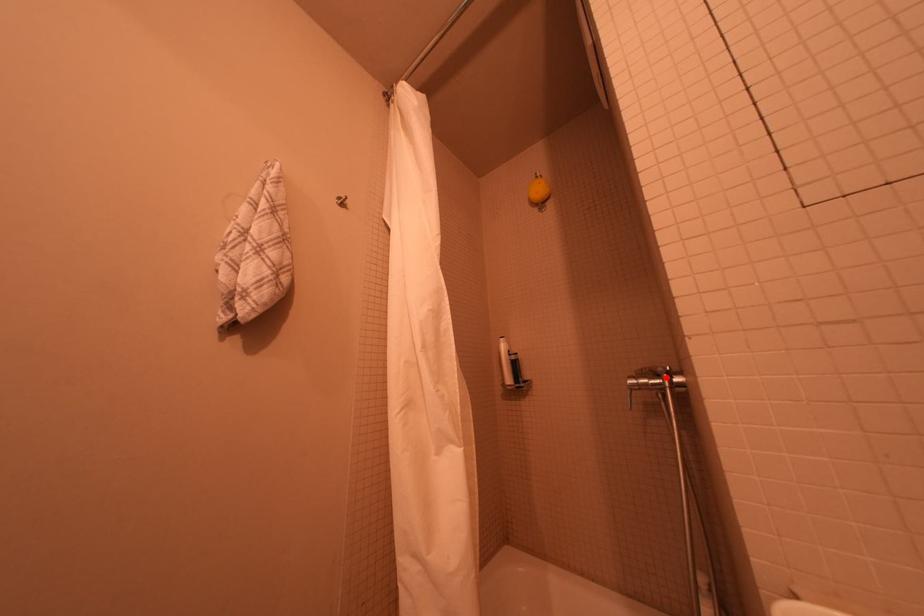
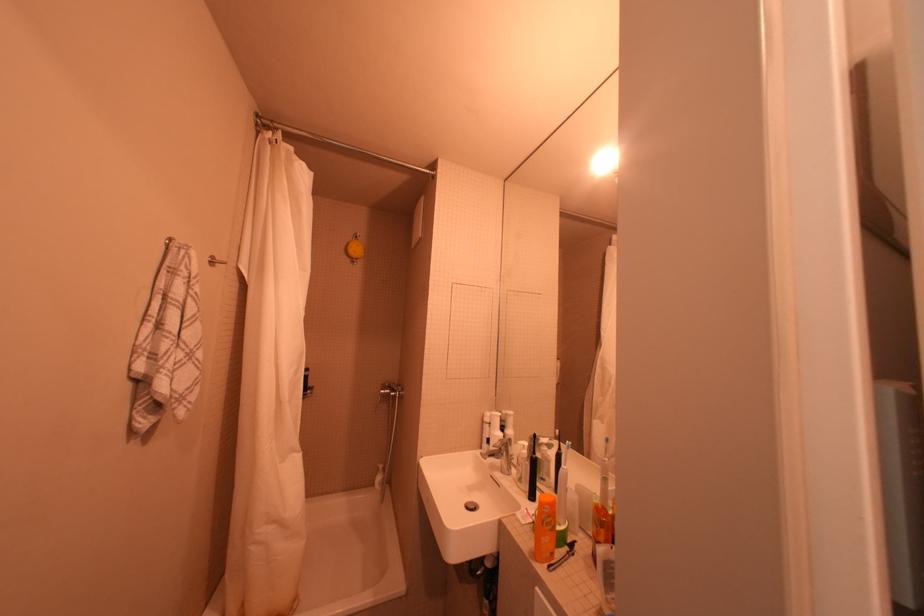
Locate, in the second image, the point that corresponds to the highlighted location in the first image.

(402, 391)